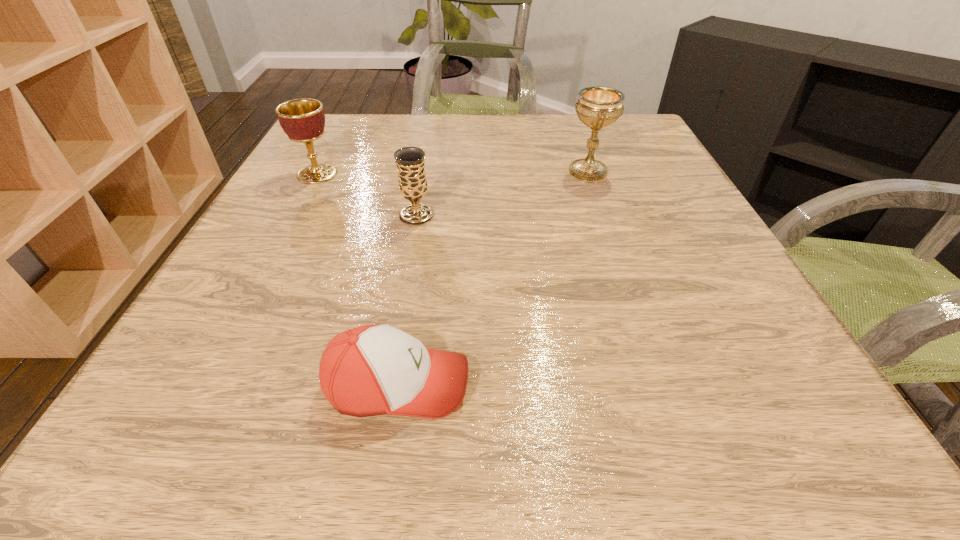
Where is `the rightmost object`? The height and width of the screenshot is (540, 960). the rightmost object is located at coordinates (597, 107).

Identify the location of the leftmost chalice. (303, 120).

Identify the location of the third farthest object. (410, 161).

Locate an element on the screen. This screenshot has width=960, height=540. the second chalice from left to right is located at coordinates (410, 161).

This screenshot has width=960, height=540. Identify the location of the shortest object. (370, 370).

Locate an element on the screen. This screenshot has width=960, height=540. the nearest object is located at coordinates (370, 370).

Locate an element on the screen. free space located on the front of the rightmost chalice is located at coordinates (636, 307).

This screenshot has width=960, height=540. What are the coordinates of `free region located on the right of the leftmost chalice` in the screenshot? It's located at (503, 174).

This screenshot has width=960, height=540. I want to click on free location located 0.240m on the left of the second nearest object, so click(x=275, y=215).

In order to click on vacant space located 0.270m on the front-facing side of the baseball cap in this screenshot , I will do `click(677, 384)`.